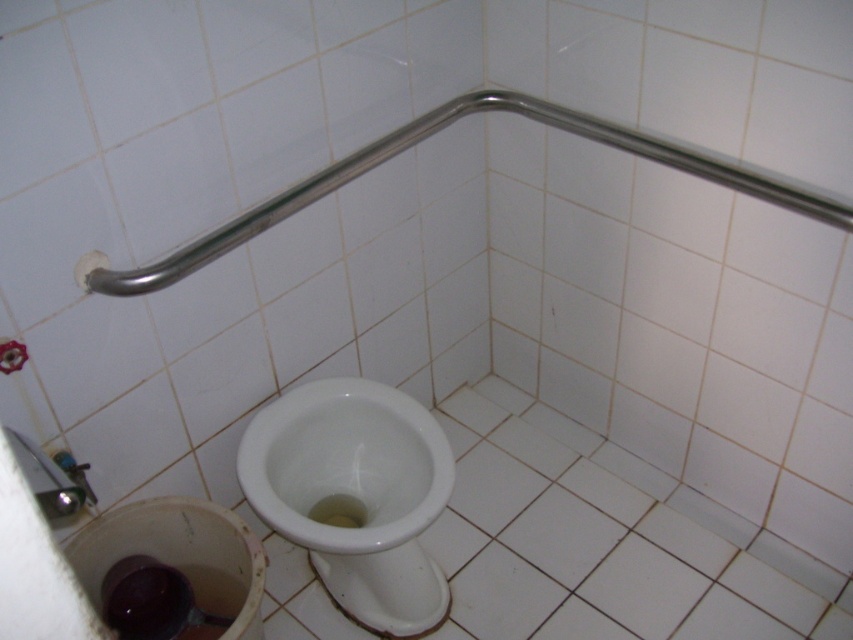
You are a home inspector assessing the bathroom. You need to determine if the polished stainless steel grab bar at upper center is taller than the white glossy toilet bowl at center. Based on the scene, what is your conclusion?

The white glossy toilet bowl at center has a greater height compared to the polished stainless steel grab bar at upper center, so the grab bar is not taller than the toilet bowl.